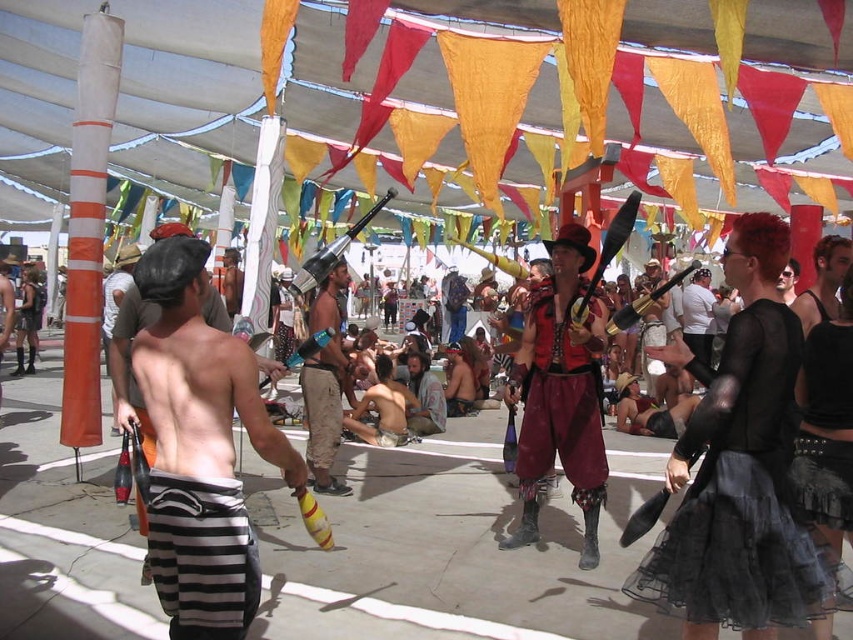
Question: Does maroon leather pants at center appear on the left side of shiny metallic helmet at center?

Choices:
 (A) no
 (B) yes

Answer: (A)

Question: Considering the real-world distances, which object is farthest from the maroon leather pants at center?

Choices:
 (A) camouflage fabric shorts at center
 (B) shiny black leather jacket at center
 (C) striped fabric shorts at lower left
 (D) shiny metallic helmet at center

Answer: (C)

Question: Can you confirm if maroon leather pants at center is positioned to the left of black leather jacket at center?

Choices:
 (A) yes
 (B) no

Answer: (A)

Question: Which object is positioned farthest from the shiny metallic helmet at center?

Choices:
 (A) black sheer top at center
 (B) striped fabric shorts at lower left

Answer: (B)

Question: Can you confirm if maroon leather pants at center is smaller than striped fabric shorts at lower left?

Choices:
 (A) no
 (B) yes

Answer: (A)

Question: Which of the following is the farthest from the observer?

Choices:
 (A) (33, 328)
 (B) (701, 324)

Answer: (A)